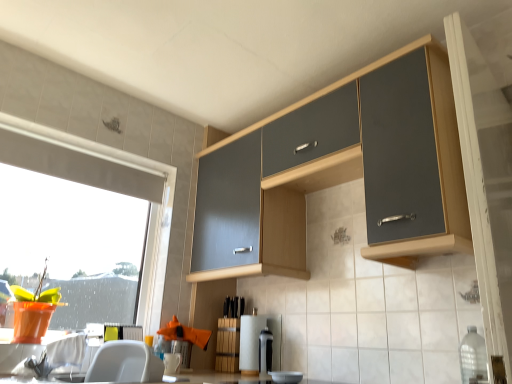
Question: Is clear plastic bottle at lower right facing towards transparent glass window at left?

Choices:
 (A) yes
 (B) no

Answer: (B)

Question: Does clear plastic bottle at lower right lie in front of transparent glass window at left?

Choices:
 (A) yes
 (B) no

Answer: (A)

Question: Is there a large distance between clear plastic bottle at lower right and transparent glass window at left?

Choices:
 (A) no
 (B) yes

Answer: (B)

Question: Is clear plastic bottle at lower right positioned behind transparent glass window at left?

Choices:
 (A) no
 (B) yes

Answer: (A)

Question: Is clear plastic bottle at lower right positioned with its back to transparent glass window at left?

Choices:
 (A) no
 (B) yes

Answer: (A)

Question: Is clear plastic bottle at lower right shorter than transparent glass window at left?

Choices:
 (A) yes
 (B) no

Answer: (A)

Question: Is white glossy countertop at lower center to the left of white paper towel at center, the first appliance in the left-to-right sequence, from the viewer's perspective?

Choices:
 (A) no
 (B) yes

Answer: (B)

Question: Is there a large distance between white glossy countertop at lower center and white paper towel at center, the first appliance in the left-to-right sequence?

Choices:
 (A) yes
 (B) no

Answer: (B)

Question: From a real-world perspective, does white glossy countertop at lower center sit lower than white paper towel at center, the 2th appliance when ordered from right to left?

Choices:
 (A) yes
 (B) no

Answer: (A)

Question: From a real-world perspective, is white glossy countertop at lower center located higher than white paper towel at center, the first appliance in the left-to-right sequence?

Choices:
 (A) no
 (B) yes

Answer: (A)

Question: Can you confirm if white glossy countertop at lower center is wider than white paper towel at center, the 2th appliance when ordered from right to left?

Choices:
 (A) yes
 (B) no

Answer: (A)

Question: Is white glossy countertop at lower center facing towards white paper towel at center, the 2th appliance when ordered from right to left?

Choices:
 (A) no
 (B) yes

Answer: (A)

Question: Is matte wood screen door at upper right not inside matte gray cabinet at upper center?

Choices:
 (A) yes
 (B) no

Answer: (A)